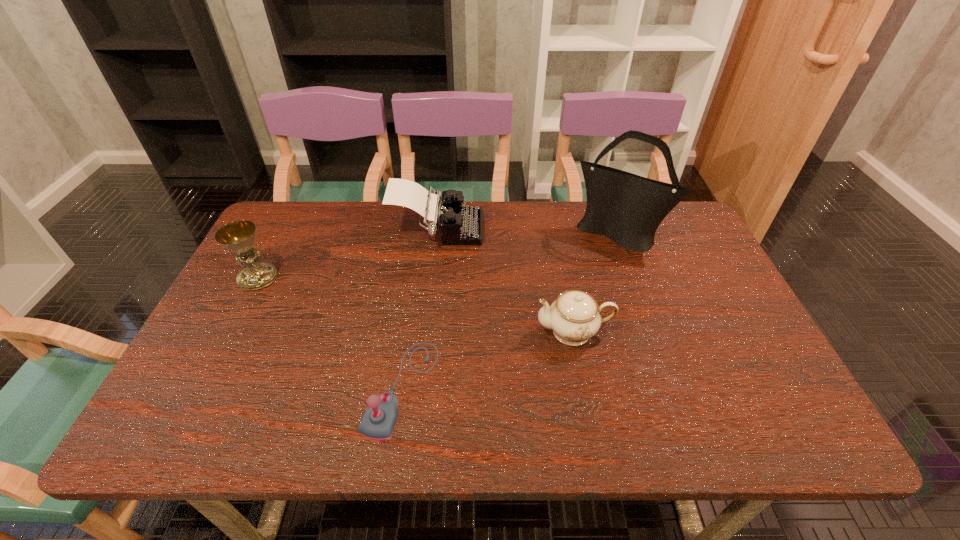
Where is `free space that satisfies the following two spatial constraints: 1. on the back side of the joystick; 2. on the right side of the tallest object`? This screenshot has width=960, height=540. free space that satisfies the following two spatial constraints: 1. on the back side of the joystick; 2. on the right side of the tallest object is located at coordinates (x=424, y=235).

Locate an element on the screen. vacant region that satisfies the following two spatial constraints: 1. at the spout of the chinaware; 2. on the front side of the joystick is located at coordinates (585, 388).

Find the location of a particular element. The width and height of the screenshot is (960, 540). blank space that satisfies the following two spatial constraints: 1. on the front side of the shoulder bag; 2. at the spout of the chinaware is located at coordinates (653, 332).